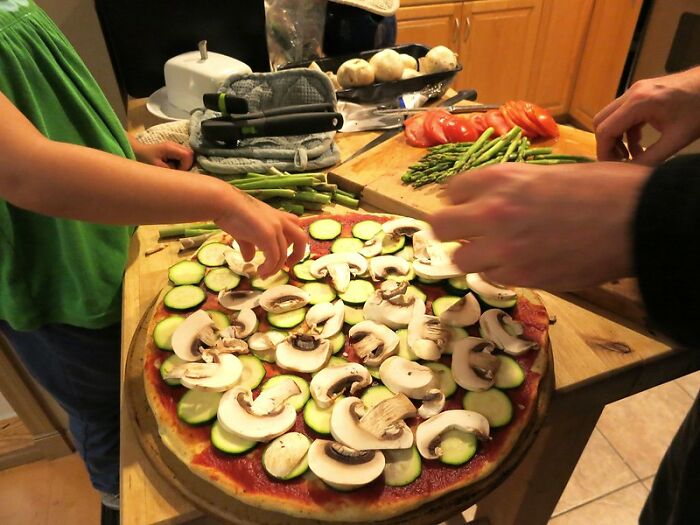
Identify the location of wooden bottom cabinet. This screenshot has height=525, width=700. (489, 39).